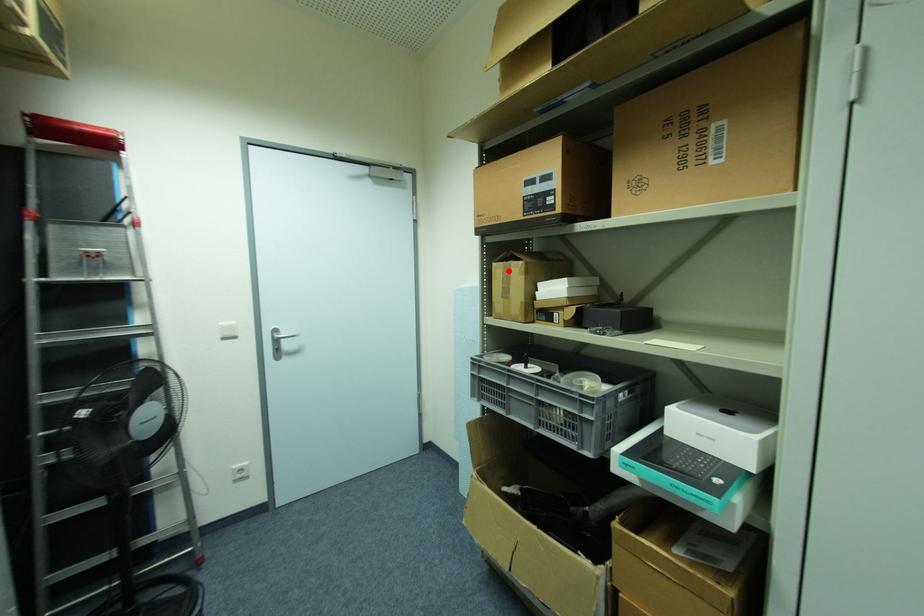
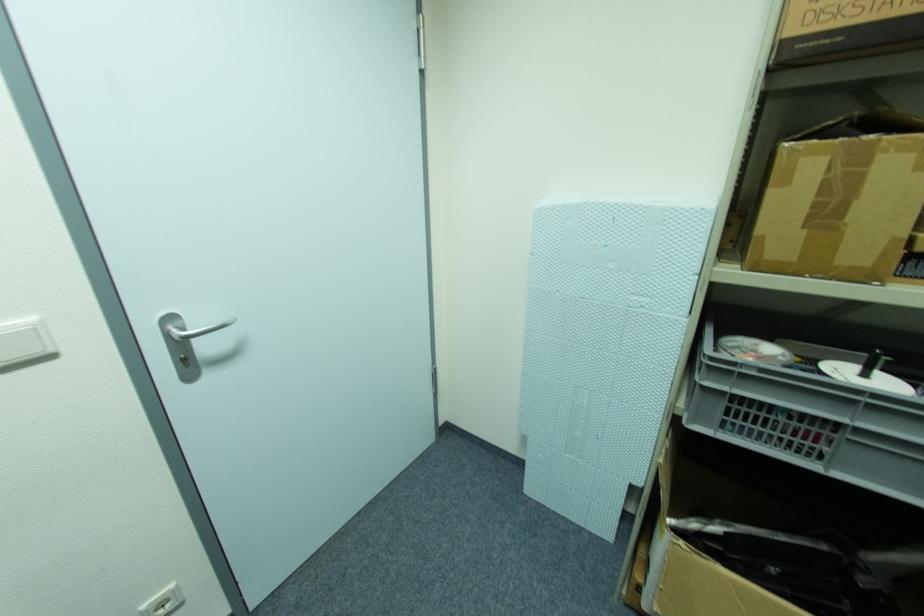
Locate, in the second image, the point that corresponds to the highlighted location in the first image.

(859, 159)